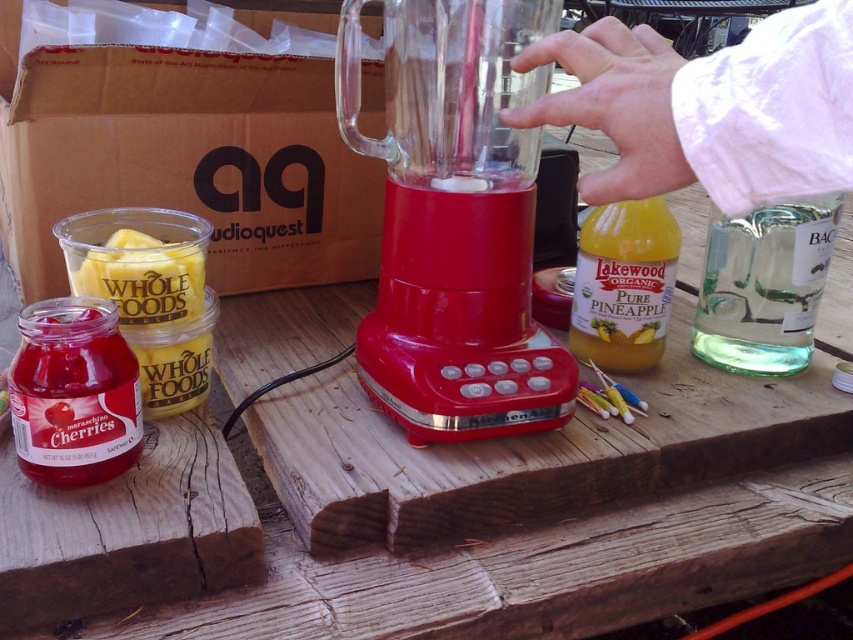
Question: Which object is closer to the camera taking this photo?

Choices:
 (A) translucent glass bottle of pure pineapple juice at center-right
 (B) clear glass at right

Answer: (B)

Question: Is clear plastic blender at center bigger than translucent glass bottle of pure pineapple juice at center-right?

Choices:
 (A) no
 (B) yes

Answer: (B)

Question: Does clear plastic blender at center appear over translucent glass bottle of pure pineapple juice at center-right?

Choices:
 (A) no
 (B) yes

Answer: (B)

Question: Can you confirm if clear plastic blender at center is positioned below clear glass at right?

Choices:
 (A) yes
 (B) no

Answer: (B)

Question: Which object is closer to the camera taking this photo?

Choices:
 (A) clear glass at right
 (B) translucent glass bottle of pure pineapple juice at center-right
 (C) clear plastic blender at center

Answer: (C)

Question: Among these points, which one is nearest to the camera?

Choices:
 (A) (619, 285)
 (B) (614, 138)

Answer: (B)